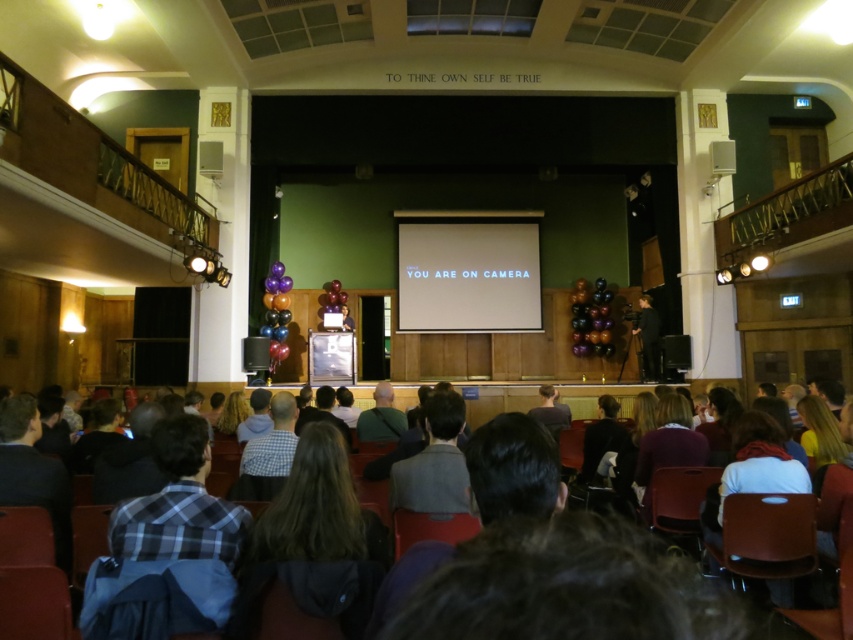
Question: Is white glossy projection screen at center wider than green fabric bag at center?

Choices:
 (A) no
 (B) yes

Answer: (B)

Question: Considering the relative positions of green fabric bag at center and black matte suit at center in the image provided, where is green fabric bag at center located with respect to black matte suit at center?

Choices:
 (A) above
 (B) below

Answer: (B)

Question: Among these points, which one is nearest to the camera?

Choices:
 (A) (642, 308)
 (B) (506, 570)
 (C) (369, 435)
 (D) (532, 259)

Answer: (B)

Question: Does white glossy projection screen at center appear over black matte suit at center?

Choices:
 (A) yes
 (B) no

Answer: (A)

Question: Estimate the real-world distances between objects in this image. Which object is farther from the green fabric bag at center?

Choices:
 (A) white glossy projection screen at center
 (B) dark brown wood chairs at lower center
 (C) black matte suit at center

Answer: (A)

Question: Which point is closer to the camera taking this photo?

Choices:
 (A) (373, 426)
 (B) (538, 246)

Answer: (A)